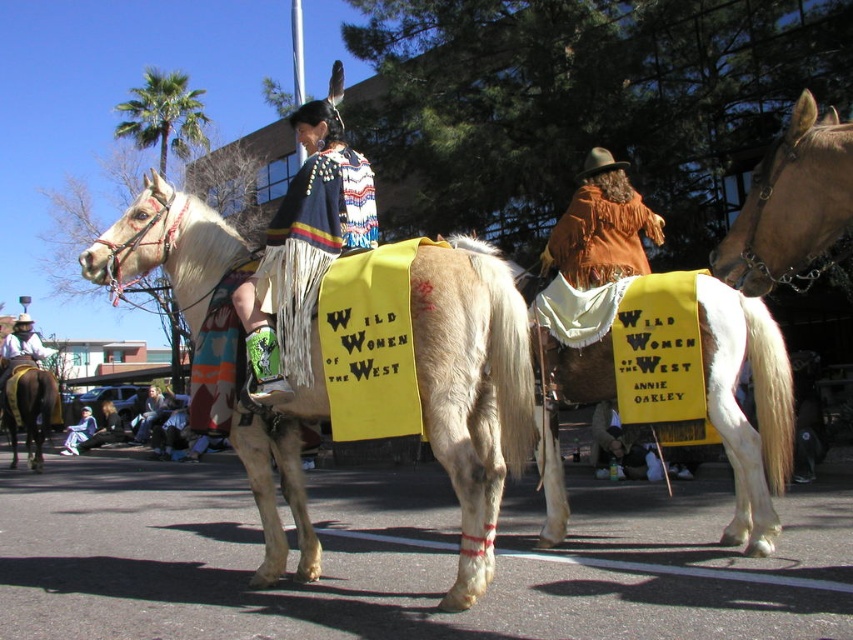
Question: Which point is closer to the camera taking this photo?

Choices:
 (A) (755, 275)
 (B) (86, 429)
 (C) (570, 321)

Answer: (A)

Question: Can you confirm if white textured horse at center is positioned to the right of light blue fabric at lower left?

Choices:
 (A) no
 (B) yes

Answer: (B)

Question: Which object appears closest to the camera in this image?

Choices:
 (A) brown glossy horse at upper right
 (B) white leather cowboy hat at left
 (C) white textured horse at center
 (D) light brown leather jacket at center

Answer: (A)

Question: Considering the relative positions of white leather saddle at center and brown glossy horse at left in the image provided, where is white leather saddle at center located with respect to brown glossy horse at left?

Choices:
 (A) left
 (B) right

Answer: (B)

Question: Can you confirm if brown fringed cape at center is wider than light blue fabric at lower left?

Choices:
 (A) no
 (B) yes

Answer: (A)

Question: Which of these objects is positioned closest to the white textured horse at center?

Choices:
 (A) denim jacket at lower left
 (B) white leather cowboy hat at left

Answer: (B)